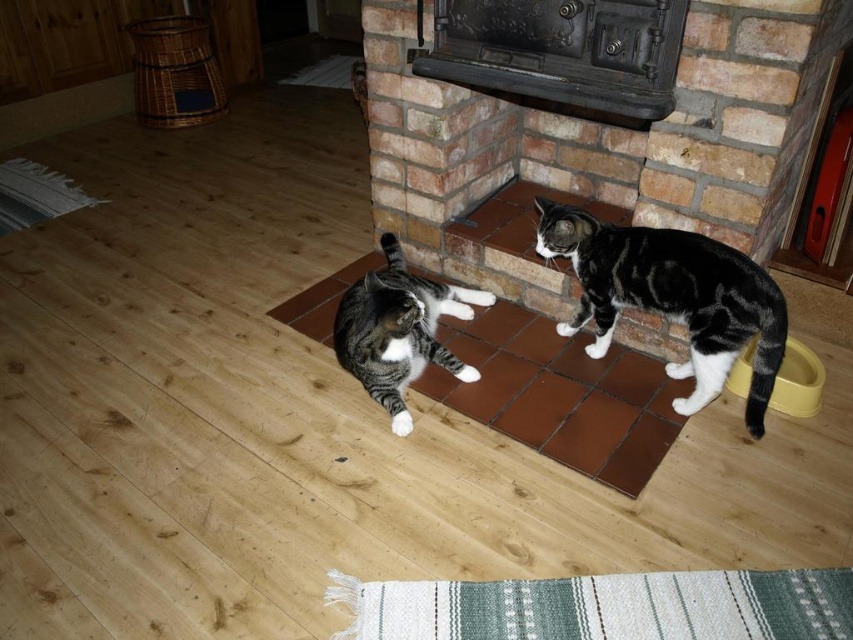
You are trying to place a new rectangular rug in the living room. The green woven mat at lower center and the tabby fur cat at right are currently in the way. Which object should you move to make space for the rug, considering their widths?

The green woven mat at lower center might be wider than the tabby fur cat at right, so you should move the green woven mat at lower center to make space for the rug since it is wider.

You are standing in the living room and want to place a 1.5 meter long ladder against the wall behind the green woven mat at lower center. Can you fit the ladder there without it overlapping the mat?

The green woven mat at lower center is 1.42 meters away from the viewer. Since the ladder is 1.5 meters long, it would extend beyond the mat by approximately 0.08 meters. However, this calculation assumes the ladder is placed directly behind the mat. To ensure the ladder doesn not overlap the mat, you would need at least 1.42 meters of space behind it. Since the ladder is longer than the distance from the viewer to the mat, placing it directly behind may cause overlap. A safer option is to position the ladd

Based on the photo, you are standing in the living room and want to place a small potted plant on the floor. The potted plant is 15 cm in diameter. There is a green woven mat at lower center located at point [605,605]. Can you place the potted plant entirely on the green woven mat at lower center without any part hanging off?

The green woven mat at lower center is located at point [605,605]. Since the mat is at that specific coordinate, you can place the potted plant there as long as the mat is large enough. However, the exact size of the mat isnanot provided, so it is uncertain whether the 15 cm diameter plant will fit entirely. Additional information about the mat size is needed to confirm.